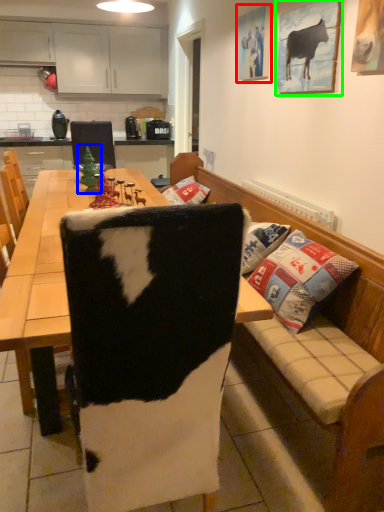
Question: Based on their relative distances, which object is farther from picture frame (highlighted by a red box)? Choose from christmas tree (highlighted by a blue box) and picture frame (highlighted by a green box).

Choices:
 (A) christmas tree
 (B) picture frame

Answer: (A)